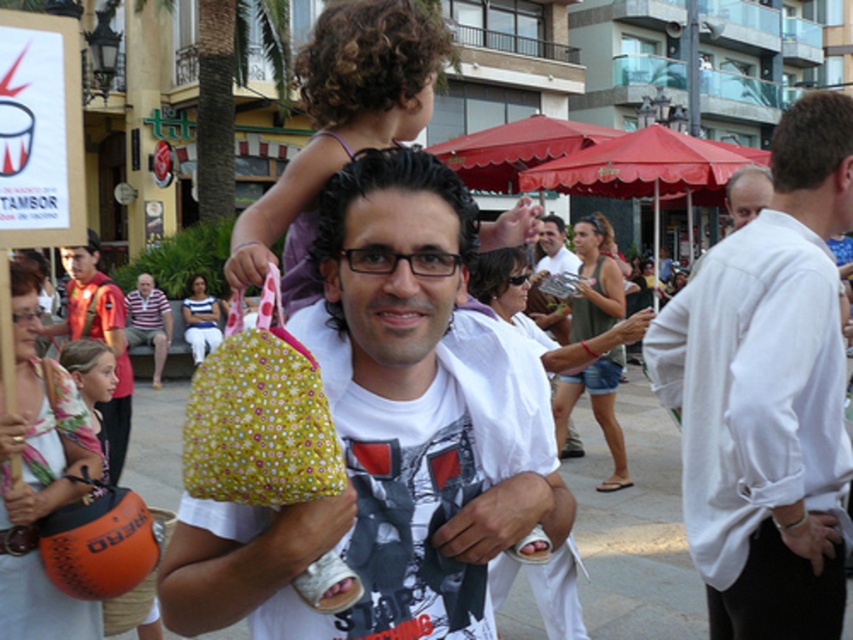
Question: Can you confirm if white cotton shirt at right is thinner than striped polo shirt at center?

Choices:
 (A) no
 (B) yes

Answer: (B)

Question: Which point is closer to the camera?

Choices:
 (A) (49, 438)
 (B) (355, 224)

Answer: (B)

Question: Which of these objects is positioned closest to the striped polo shirt at center?

Choices:
 (A) curly-haired girl at center
 (B) white paper sign at upper left
 (C) floral fabric bag at center
 (D) orange fabric drum at lower left

Answer: (D)

Question: Which object appears closest to the camera in this image?

Choices:
 (A) white cotton shirt at right
 (B) floral fabric bag at center
 (C) orange fabric drum at lower left

Answer: (B)

Question: Does white paper sign at upper left have a larger size compared to striped polo shirt at center?

Choices:
 (A) yes
 (B) no

Answer: (B)

Question: Does floral fabric bag at center appear under white cotton shirt at right?

Choices:
 (A) yes
 (B) no

Answer: (A)